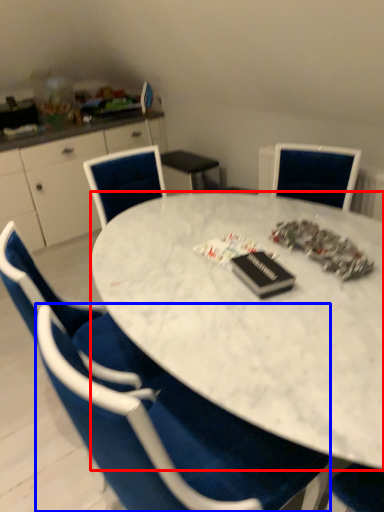
Question: Which object appears closest to the camera in this image, desk (highlighted by a red box) or chair (highlighted by a blue box)?

Choices:
 (A) desk
 (B) chair

Answer: (B)